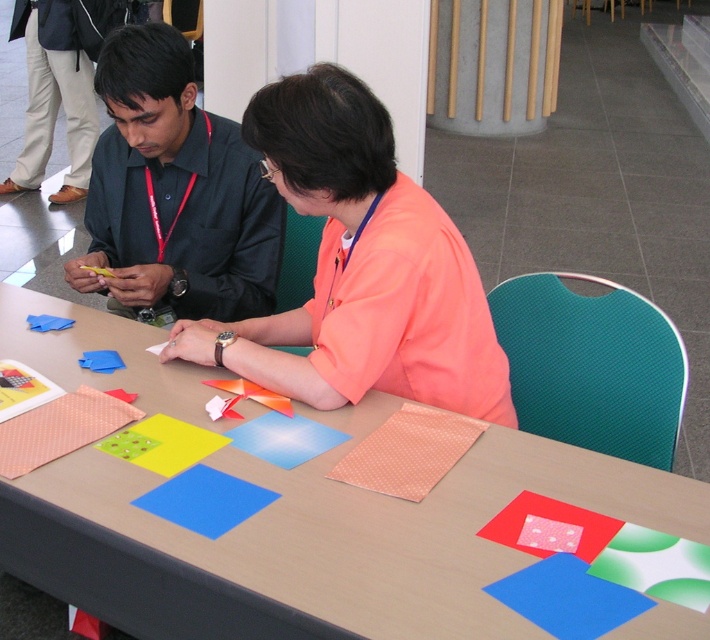
Question: Is orange matte shirt at center smaller than matte black shirt at left?

Choices:
 (A) no
 (B) yes

Answer: (A)

Question: Which point is closer to the camera?

Choices:
 (A) (195, 337)
 (B) (104, 145)

Answer: (A)

Question: Estimate the real-world distances between objects in this image. Which object is farther from the smooth wooden table at center?

Choices:
 (A) orange matte shirt at center
 (B) matte black shirt at left

Answer: (B)

Question: Among these points, which one is farthest from the camera?

Choices:
 (A) (447, 552)
 (B) (376, 113)
 (C) (245, 259)

Answer: (C)

Question: Can you confirm if orange matte shirt at center is positioned to the left of matte black shirt at left?

Choices:
 (A) yes
 (B) no

Answer: (B)

Question: In this image, where is smooth wooden table at center located relative to orange matte shirt at center?

Choices:
 (A) below
 (B) above

Answer: (A)